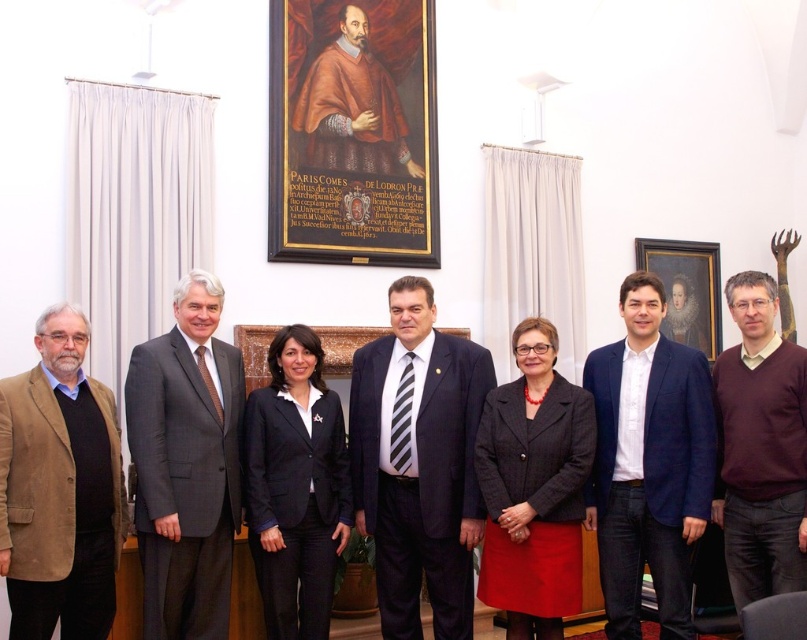
Question: Is dark blue suit at center above blue fabric suit at center?

Choices:
 (A) no
 (B) yes

Answer: (A)

Question: Among these objects, which one is farthest from the camera?

Choices:
 (A) dark gray textured blazer at center
 (B) brown suede blazer at left
 (C) black fabric blazer at center

Answer: (C)

Question: Considering the relative positions of black fabric blazer at center and wooden picture frame at center in the image provided, where is black fabric blazer at center located with respect to wooden picture frame at center?

Choices:
 (A) left
 (B) right

Answer: (A)

Question: Does black fabric blazer at center have a greater width compared to dark purple sweater at center?

Choices:
 (A) yes
 (B) no

Answer: (A)

Question: Based on their relative distances, which object is farther from the dark blue suit at center?

Choices:
 (A) wooden picture frame at center
 (B) wooden framed portrait at upper center
 (C) dark gray textured blazer at center
 (D) brown suede blazer at left

Answer: (A)

Question: Which point is closer to the camera taking this photo?

Choices:
 (A) (711, 275)
 (B) (132, 376)
 (C) (659, 529)

Answer: (B)